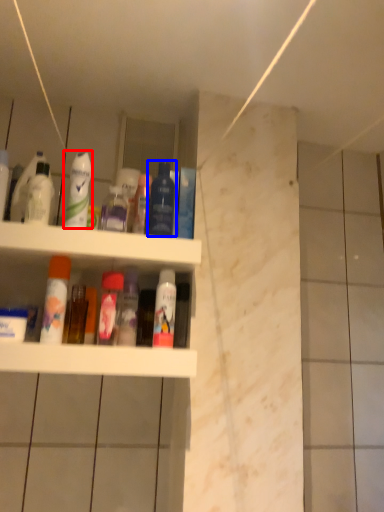
Question: Which object appears farthest to the camera in this image, cleaning product (highlighted by a red box) or mouthwash (highlighted by a blue box)?

Choices:
 (A) cleaning product
 (B) mouthwash

Answer: (B)